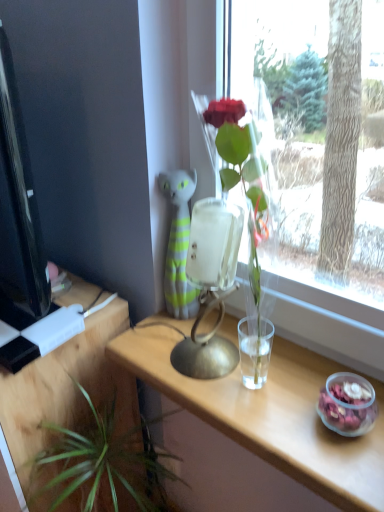
Question: Is green leafy plant at lower left not within clear wood table at center, the 2th table viewed from the left?

Choices:
 (A) no
 (B) yes

Answer: (B)

Question: Is green leafy plant at lower left oriented towards clear wood table at center, the 1th table from the right?

Choices:
 (A) no
 (B) yes

Answer: (A)

Question: Is green leafy plant at lower left further to camera compared to clear wood table at center, the 1th table from the right?

Choices:
 (A) yes
 (B) no

Answer: (A)

Question: Is green leafy plant at lower left in front of clear wood table at center, the 2th table viewed from the left?

Choices:
 (A) no
 (B) yes

Answer: (A)

Question: Is green leafy plant at lower left not near clear wood table at center, the 2th table viewed from the left?

Choices:
 (A) yes
 (B) no

Answer: (B)

Question: In terms of width, does clear wood table at center, the 1th table from the right, look wider or thinner when compared to wooden table at lower left, the 1th table in the left-to-right sequence?

Choices:
 (A) thin
 (B) wide

Answer: (A)

Question: Is clear wood table at center, the 2th table viewed from the left, to the left or to the right of wooden table at lower left, the 2th table when ordered from right to left, in the image?

Choices:
 (A) left
 (B) right

Answer: (B)

Question: In the image, is clear wood table at center, the 2th table viewed from the left, positioned in front of or behind wooden table at lower left, the 1th table in the left-to-right sequence?

Choices:
 (A) behind
 (B) front

Answer: (B)

Question: Considering the positions of point (221, 393) and point (84, 373), is point (221, 393) closer or farther from the camera than point (84, 373)?

Choices:
 (A) farther
 (B) closer

Answer: (B)

Question: Is black glossy computer monitor at left bigger or smaller than wooden table at lower left, the 1th table in the left-to-right sequence?

Choices:
 (A) small
 (B) big

Answer: (A)

Question: Looking at their shapes, would you say black glossy computer monitor at left is wider or thinner than wooden table at lower left, the 1th table in the left-to-right sequence?

Choices:
 (A) wide
 (B) thin

Answer: (B)

Question: From a real-world perspective, is black glossy computer monitor at left above or below wooden table at lower left, the 2th table when ordered from right to left?

Choices:
 (A) below
 (B) above

Answer: (B)

Question: From the image's perspective, is black glossy computer monitor at left above or below wooden table at lower left, the 1th table in the left-to-right sequence?

Choices:
 (A) below
 (B) above

Answer: (B)

Question: From the image's perspective, is black glossy computer monitor at left positioned above or below clear wood table at center, the 2th table viewed from the left?

Choices:
 (A) below
 (B) above

Answer: (B)

Question: From a real-world perspective, is black glossy computer monitor at left positioned above or below clear wood table at center, the 2th table viewed from the left?

Choices:
 (A) below
 (B) above

Answer: (B)